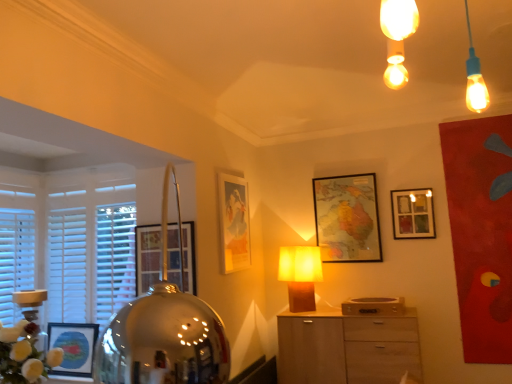
What do you see at coordinates (347, 218) in the screenshot?
I see `wooden map at center, which appears as the 2th picture frame when viewed from the right` at bounding box center [347, 218].

What are the coordinates of `white wooden blinds at left` in the screenshot? It's located at (90, 262).

You are a GUI agent. You are given a task and a screenshot of the screen. Output one action in this format:
    pyautogui.click(x=<x>, y=<y>)
    Task: Click on the matte glass picture frame at upper right, which is the 1th picture frame from right to left
    This screenshot has height=384, width=512.
    Given the screenshot: What is the action you would take?
    pyautogui.click(x=413, y=213)

Locate an element on the screen. This screenshot has width=512, height=384. white fluffy flowers at lower left is located at coordinates (24, 355).

The image size is (512, 384). I want to click on wooden map at center, which appears as the third picture frame when viewed from the left, so click(x=347, y=218).

From the picture: From the image's perspective, is matte glass picture frame at upper right, which is the 1th picture frame from right to left, located above or below light wood cabinet at center?

From the image's perspective, matte glass picture frame at upper right, which is the 1th picture frame from right to left, appears above light wood cabinet at center.

Is matte glass picture frame at upper right, which is the 1th picture frame from right to left, with light wood cabinet at center?

No, matte glass picture frame at upper right, which is the 1th picture frame from right to left, is not beside light wood cabinet at center.

Can we say matte glass picture frame at upper right, the 4th picture frame in the left-to-right sequence, lies outside light wood cabinet at center?

Absolutely, matte glass picture frame at upper right, the 4th picture frame in the left-to-right sequence, is external to light wood cabinet at center.

In terms of width, does matte glass picture frame at upper right, the 4th picture frame in the left-to-right sequence, look wider or thinner when compared to light wood cabinet at center?

matte glass picture frame at upper right, the 4th picture frame in the left-to-right sequence, is thinner than light wood cabinet at center.

Based on their positions, is matte yellow fabric lampshade at center located to the left or right of white fluffy flowers at lower left?

From the image, it's evident that matte yellow fabric lampshade at center is to the right of white fluffy flowers at lower left.

Can you confirm if matte yellow fabric lampshade at center is wider than white fluffy flowers at lower left?

No, matte yellow fabric lampshade at center is not wider than white fluffy flowers at lower left.

Based on the photo, looking at the image, does matte yellow fabric lampshade at center seem bigger or smaller compared to white fluffy flowers at lower left?

matte yellow fabric lampshade at center is smaller than white fluffy flowers at lower left.

From the picture: In the image, is matte yellow fabric lampshade at center positioned in front of or behind white fluffy flowers at lower left?

Clearly, matte yellow fabric lampshade at center is behind white fluffy flowers at lower left.

Between point (133, 234) and point (222, 225), which one is positioned behind?

Positioned behind is point (222, 225).

In the scene shown: Can you confirm if white wooden blinds at left is wider than matte gold picture frame at center, arranged as the 2th picture frame when viewed from the left?

Correct, the width of white wooden blinds at left exceeds that of matte gold picture frame at center, arranged as the 2th picture frame when viewed from the left.

From the picture: Considering the relative sizes of white wooden blinds at left and matte gold picture frame at center, arranged as the 2th picture frame when viewed from the left, in the image provided, is white wooden blinds at left taller than matte gold picture frame at center, arranged as the 2th picture frame when viewed from the left,?

Yes.

Could you measure the distance between white wooden blinds at left and matte gold picture frame at center, arranged as the 2th picture frame when viewed from the left?

white wooden blinds at left and matte gold picture frame at center, arranged as the 2th picture frame when viewed from the left, are 36.10 inches apart.

From a real-world perspective, is matte gold picture frame at center, the third picture frame positioned from the right, on matte glass picture frame at upper right, which is the 1th picture frame from right to left?

Actually, matte gold picture frame at center, the third picture frame positioned from the right, is physically below matte glass picture frame at upper right, which is the 1th picture frame from right to left, in the real world.

Which is in front, matte gold picture frame at center, arranged as the 2th picture frame when viewed from the left, or matte glass picture frame at upper right, which is the 1th picture frame from right to left?

matte gold picture frame at center, arranged as the 2th picture frame when viewed from the left.

Who is shorter, matte gold picture frame at center, the third picture frame positioned from the right, or matte glass picture frame at upper right, which is the 1th picture frame from right to left?

Standing shorter between the two is matte glass picture frame at upper right, which is the 1th picture frame from right to left.

From the picture: From the image's perspective, is matte gold picture frame at center, the third picture frame positioned from the right, beneath matte glass picture frame at upper right, which is the 1th picture frame from right to left?

Indeed, from the image's perspective, matte gold picture frame at center, the third picture frame positioned from the right, is shown beneath matte glass picture frame at upper right, which is the 1th picture frame from right to left.

In the scene shown: From a real-world perspective, is wooden map at center, which appears as the 2th picture frame when viewed from the right, beneath matte gold picture frame at center, arranged as the 2th picture frame when viewed from the left?

No, from a real-world perspective, wooden map at center, which appears as the 2th picture frame when viewed from the right, is not under matte gold picture frame at center, arranged as the 2th picture frame when viewed from the left.

Which object is wider, wooden map at center, which appears as the 2th picture frame when viewed from the right, or matte gold picture frame at center, the third picture frame positioned from the right?

With larger width is wooden map at center, which appears as the 2th picture frame when viewed from the right.

Which is farther from the camera, (326, 261) or (240, 205)?

The point (326, 261) is farther from the camera.

Can you confirm if white fluffy flowers at lower left is positioned to the left of light wood cabinet at center?

Yes.

Is white fluffy flowers at lower left positioned with its back to light wood cabinet at center?

No, white fluffy flowers at lower left's orientation is not away from light wood cabinet at center.

The height and width of the screenshot is (384, 512). Identify the location of the chest of drawers located below the white fluffy flowers at lower left (from the image's perspective). (347, 348).

From a real-world perspective, who is located lower, white fluffy flowers at lower left or light wood cabinet at center?

light wood cabinet at center, from a real-world perspective.

Considering their positions, is white wooden blinds at left located in front of or behind matte glass picture frame at upper right, which is the 1th picture frame from right to left?

Visually, white wooden blinds at left is located in front of matte glass picture frame at upper right, which is the 1th picture frame from right to left.

Based on the photo, can you confirm if white wooden blinds at left is positioned to the left of matte glass picture frame at upper right, the 4th picture frame in the left-to-right sequence?

Yes, white wooden blinds at left is to the left of matte glass picture frame at upper right, the 4th picture frame in the left-to-right sequence.

Who is taller, white wooden blinds at left or matte glass picture frame at upper right, which is the 1th picture frame from right to left?

white wooden blinds at left.

How different are the orientations of white wooden blinds at left and matte glass picture frame at upper right, which is the 1th picture frame from right to left, in degrees?

The angle between the facing direction of white wooden blinds at left and the facing direction of matte glass picture frame at upper right, which is the 1th picture frame from right to left, is 1.76 degrees.

Locate an element on the screen. This screenshot has height=384, width=512. the chest of drawers located underneath the matte glass picture frame at upper right, which is the 1th picture frame from right to left (from a real-world perspective) is located at coordinates (347, 348).

Locate an element on the screen. This screenshot has height=384, width=512. floral arrangement in front of the matte yellow fabric lampshade at center is located at coordinates (24, 355).

When comparing their distances from matte glass picture frame at upper right, which is the 1th picture frame from right to left, does matte glass picture frame at left, the 1th picture frame when ordered from left to right, or light wood cabinet at center seem further?

matte glass picture frame at left, the 1th picture frame when ordered from left to right.

Based on their spatial positions, is matte gold picture frame at center, arranged as the 2th picture frame when viewed from the left, or white wooden blinds at left further from matte yellow fabric lampshade at center?

white wooden blinds at left.

Estimate the real-world distances between objects in this image. Which object is further from wooden map at center, which appears as the 2th picture frame when viewed from the right, matte glass picture frame at left, the 1th picture frame when ordered from left to right, or light wood cabinet at center?

matte glass picture frame at left, the 1th picture frame when ordered from left to right, is further to wooden map at center, which appears as the 2th picture frame when viewed from the right.

Estimate the real-world distances between objects in this image. Which object is further from wooden map at center, which appears as the third picture frame when viewed from the left, matte gold picture frame at center, arranged as the 2th picture frame when viewed from the left, or white fluffy flowers at lower left?

Based on the image, white fluffy flowers at lower left appears to be further to wooden map at center, which appears as the third picture frame when viewed from the left.

When comparing their distances from matte gold picture frame at center, arranged as the 2th picture frame when viewed from the left, does light wood cabinet at center or matte glass picture frame at left, the 1th picture frame when ordered from left to right, seem further?

light wood cabinet at center is positioned further to the anchor matte gold picture frame at center, arranged as the 2th picture frame when viewed from the left.

Considering their positions, is matte gold picture frame at center, arranged as the 2th picture frame when viewed from the left, positioned closer to matte glass picture frame at upper right, which is the 1th picture frame from right to left, than matte glass picture frame at left, acting as the 4th picture frame starting from the right?

matte gold picture frame at center, arranged as the 2th picture frame when viewed from the left, is positioned closer to the anchor matte glass picture frame at upper right, which is the 1th picture frame from right to left.

Considering their positions, is wooden map at center, which appears as the third picture frame when viewed from the left, positioned further to matte glass picture frame at upper right, which is the 1th picture frame from right to left, than white wooden blinds at left?

white wooden blinds at left is further to matte glass picture frame at upper right, which is the 1th picture frame from right to left.

Looking at the image, which one is located further to matte glass picture frame at upper right, which is the 1th picture frame from right to left, light wood cabinet at center or matte glass picture frame at left, the 1th picture frame when ordered from left to right?

matte glass picture frame at left, the 1th picture frame when ordered from left to right.

Identify the location of lamp between white fluffy flowers at lower left and light wood cabinet at center. This screenshot has width=512, height=384. (300, 275).

This screenshot has height=384, width=512. Find the location of `floral arrangement between white wooden blinds at left and light wood cabinet at center`. floral arrangement between white wooden blinds at left and light wood cabinet at center is located at coordinates pyautogui.click(x=24, y=355).

The height and width of the screenshot is (384, 512). Identify the location of picture frame between white fluffy flowers at lower left and white wooden blinds at left along the z-axis. (147, 257).

Find the location of a particular element. The image size is (512, 384). floral arrangement located between white wooden blinds at left and wooden map at center, which appears as the 2th picture frame when viewed from the right, in the left-right direction is located at coordinates (24, 355).